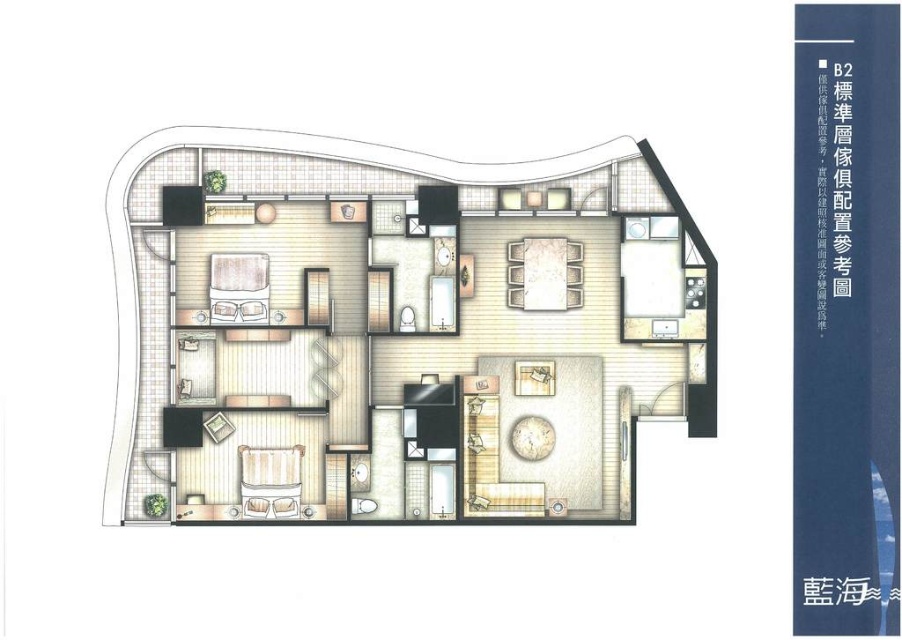
You are standing at the entrance of the residential unit B2 and want to place a 100 feet long sofa in the living area. Can the sofa fit in the space between the entrance and the matte wood coffee table at center?

The distance from the entrance to the matte wood coffee table at center is 82.40 feet. Since the sofa is 100 feet long, it cannot fit in the available space.

You are a delivery person trying to place a package on the floor between the matte wood coffee table at center and the matte white bed at center. The package is 3 feet long. Can you fit it there without moving either object?

The distance between the matte wood coffee table at center and the matte white bed at center is 6.02 feet. Since the package is 3 feet long, it can be placed in the space between them as the distance is sufficient to accommodate it.

You are moving into this residential unit and need to determine the placement of your new sofa. The sofa is 1.8 meters wide. There is a space between the striped fabric bed at center and the matte white bed at center. Can the sofa fit in that space?

The striped fabric bed at center is positioned on the right side of the matte white bed at center. The space between them is not specified in the provided information, so it is unclear if the sofa will fit. Please check the exact dimensions of the space.